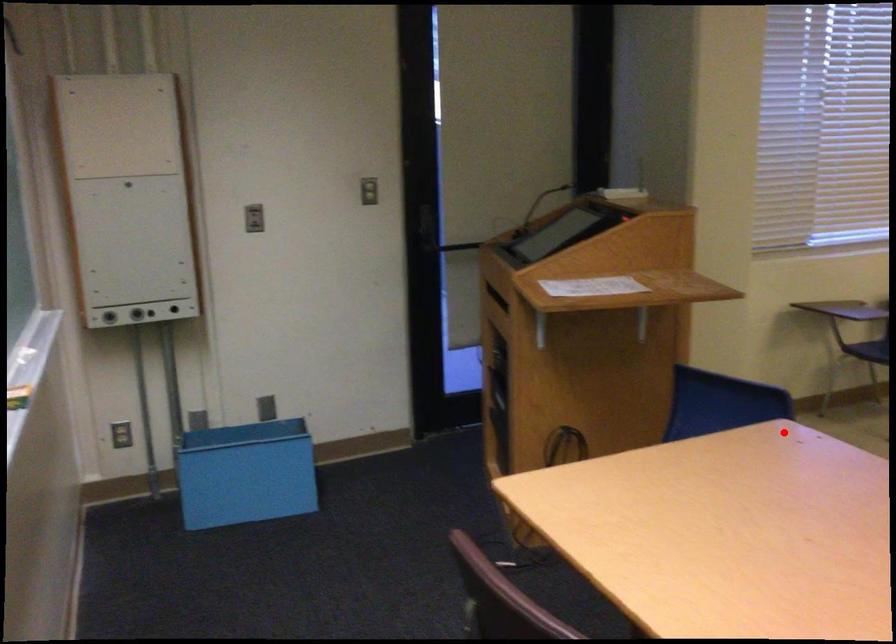
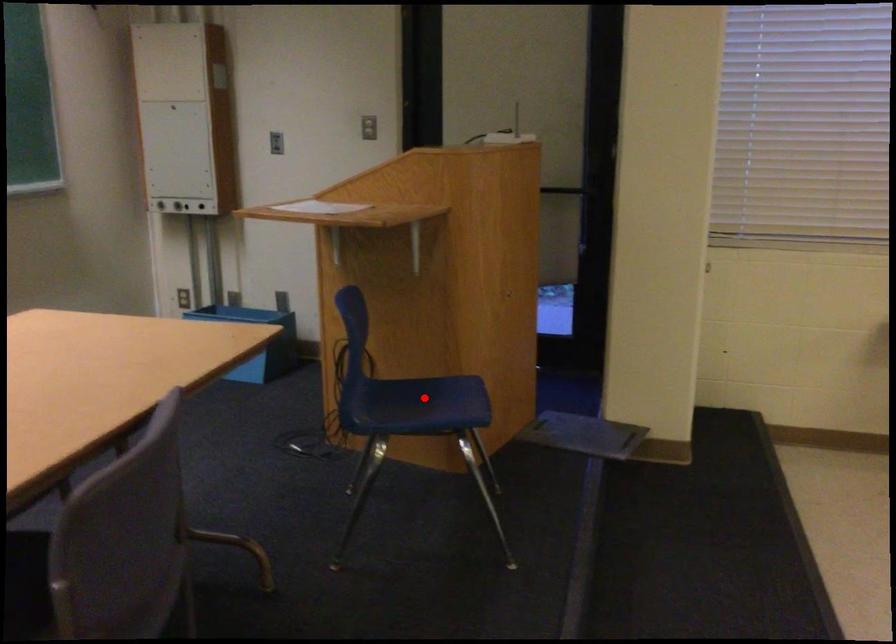
I am providing you with two images of the same scene from different viewpoints. A red point is marked on the first image and another point is marked on the second image. Are the points marked in image1 and image2 representing the same 3D position?

No